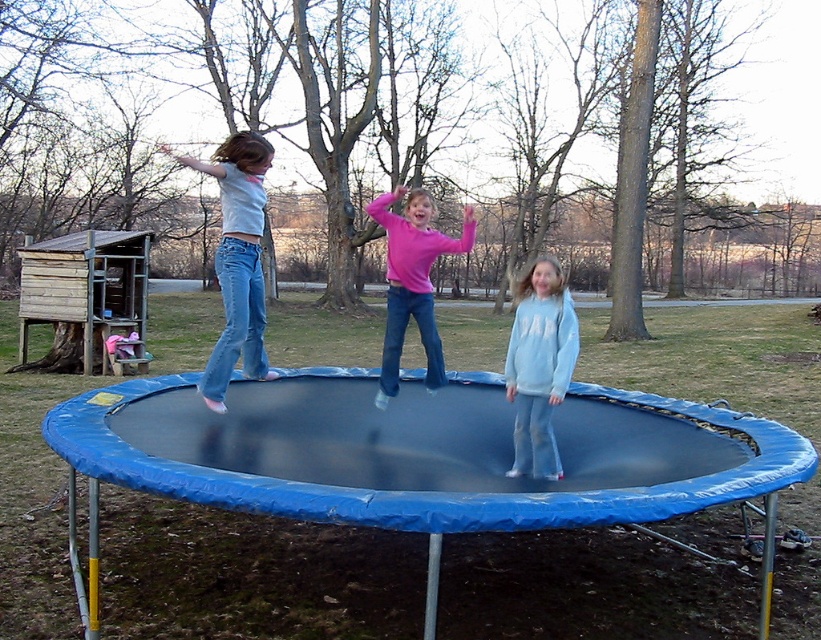
Can you confirm if blue rubber trampoline at center is shorter than light blue fleece sweatshirt at center?

Yes.

Does blue rubber trampoline at center appear on the left side of light blue fleece sweatshirt at center?

Indeed, blue rubber trampoline at center is positioned on the left side of light blue fleece sweatshirt at center.

Find the location of a particular element. The image size is (821, 640). blue rubber trampoline at center is located at coordinates (443, 488).

Does light blue denim jeans at left have a greater height compared to light blue fleece sweatshirt at center?

No, light blue denim jeans at left is not taller than light blue fleece sweatshirt at center.

Can you confirm if light blue denim jeans at left is positioned to the right of light blue fleece sweatshirt at center?

No, light blue denim jeans at left is not to the right of light blue fleece sweatshirt at center.

Is point (237, 307) positioned after point (551, 355)?

That is True.

You are a GUI agent. You are given a task and a screenshot of the screen. Output one action in this format:
    pyautogui.click(x=<x>, y=<y>)
    Task: Click on the light blue denim jeans at left
    This screenshot has width=821, height=640.
    Given the screenshot: What is the action you would take?
    pyautogui.click(x=237, y=260)

Who is higher up, blue rubber trampoline at center or light blue denim jeans at left?

light blue denim jeans at left is higher up.

Does point (722, 428) lie behind point (250, 202)?

Yes, it is.

Identify the location of blue rubber trampoline at center. This screenshot has width=821, height=640. (443, 488).